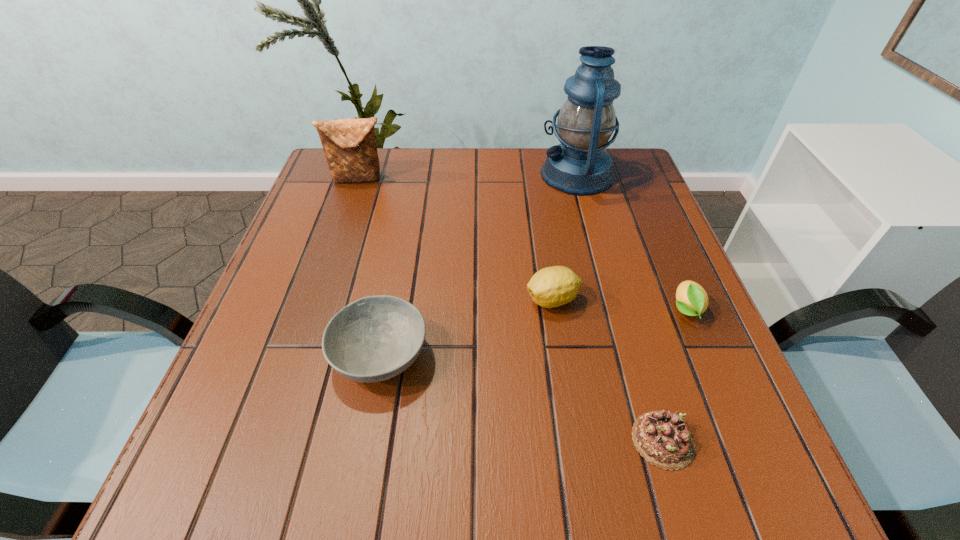
The height and width of the screenshot is (540, 960). What are the coordinates of `vacant area between the tallest object and the clutch bag` in the screenshot? It's located at (468, 177).

This screenshot has width=960, height=540. Identify the location of free space between the tallest object and the clutch bag. (468, 177).

Find the location of a particular element. This screenshot has height=540, width=960. free area in between the chocolate cake and the left lemon is located at coordinates (608, 370).

Locate an element on the screen. The width and height of the screenshot is (960, 540). blank region between the fifth shortest object and the tallest object is located at coordinates (468, 177).

You are a GUI agent. You are given a task and a screenshot of the screen. Output one action in this format:
    pyautogui.click(x=<x>, y=<y>)
    Task: Click on the object identified as the second closest to the nearest object
    The width and height of the screenshot is (960, 540).
    Given the screenshot: What is the action you would take?
    pyautogui.click(x=550, y=287)

The height and width of the screenshot is (540, 960). In order to click on the third closest object to the shortest object in this screenshot , I will do `click(375, 338)`.

This screenshot has height=540, width=960. I want to click on vacant space that satisfies the following two spatial constraints: 1. on the face of the lantern; 2. on the open side of the clutch bag, so click(x=578, y=179).

Locate an element on the screen. The image size is (960, 540). blank area in the image that satisfies the following two spatial constraints: 1. on the open side of the bowl; 2. on the left side of the second tallest object is located at coordinates (300, 355).

Locate an element on the screen. vacant space that satisfies the following two spatial constraints: 1. on the face of the lantern; 2. on the front side of the bowl is located at coordinates (626, 355).

At what (x,y) coordinates should I click in order to perform the action: click on blank area in the image that satisfies the following two spatial constraints: 1. on the face of the lantern; 2. on the open side of the fifth shortest object. Please return your answer as a coordinate pair (x, y). Image resolution: width=960 pixels, height=540 pixels. Looking at the image, I should click on (578, 179).